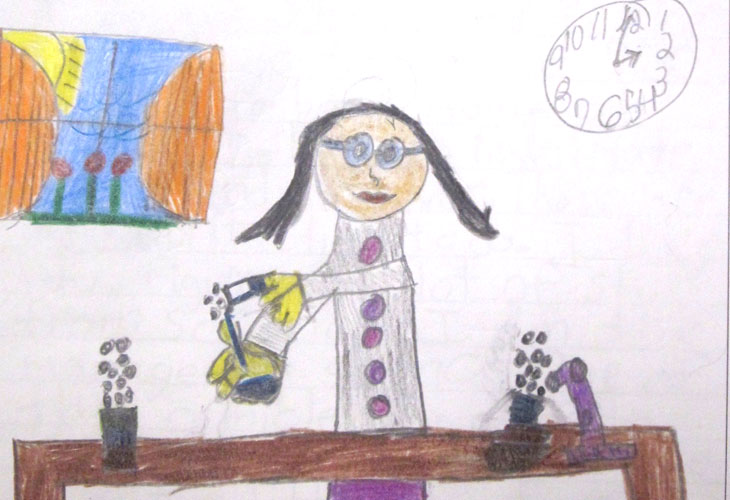
Where is `"9" in clock`? The height and width of the screenshot is (500, 730). "9" in clock is located at coordinates (560, 60).